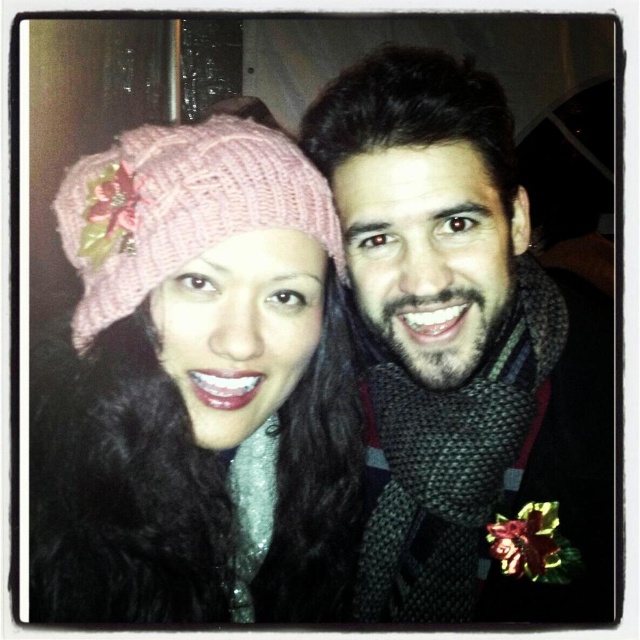
Question: Where is pink knitted hat at upper left located in relation to pink knitted hat at left in the image?

Choices:
 (A) right
 (B) left

Answer: (A)

Question: Estimate the real-world distances between objects in this image. Which object is farther from the pink knitted hat at upper left?

Choices:
 (A) knitted scarf at center
 (B) pink knitted hat at left

Answer: (A)

Question: Among these points, which one is nearest to the camera?

Choices:
 (A) (419, 145)
 (B) (124, 221)

Answer: (B)

Question: Among these objects, which one is farthest from the camera?

Choices:
 (A) knitted scarf at center
 (B) pink knitted hat at left
 (C) pink knitted hat at upper left

Answer: (A)

Question: Does knitted scarf at center appear over pink knitted hat at left?

Choices:
 (A) no
 (B) yes

Answer: (A)

Question: Is pink knitted hat at upper left bigger than pink knitted hat at left?

Choices:
 (A) yes
 (B) no

Answer: (A)